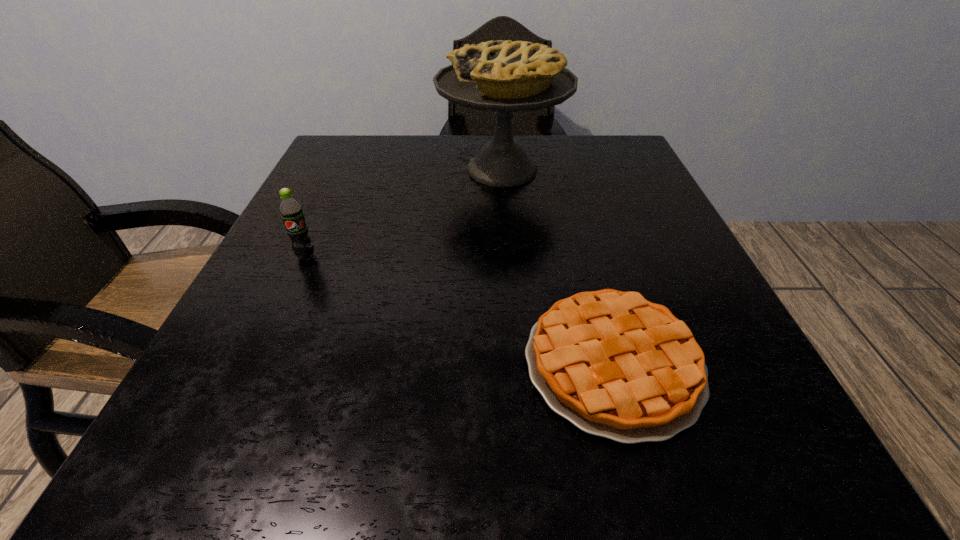
This screenshot has width=960, height=540. Find the location of `free space located 0.210m on the back of the shorter pie`. free space located 0.210m on the back of the shorter pie is located at coordinates (574, 224).

Identify the location of object that is at the far edge. (503, 76).

You are a GUI agent. You are given a task and a screenshot of the screen. Output one action in this format:
    pyautogui.click(x=<x>, y=<y>)
    Task: Click on the object present at the near edge
    
    Given the screenshot: What is the action you would take?
    pyautogui.click(x=615, y=365)

Locate an element on the screen. object that is at the left edge is located at coordinates (291, 211).

Identify the location of object that is positioned at the right edge. The image size is (960, 540). (615, 365).

Identify the location of object located at the near right corner. The height and width of the screenshot is (540, 960). (615, 365).

In the image, there is a desktop. At what (x,y) coordinates should I click in order to perform the action: click on vacant space at the far edge. Please return your answer as a coordinate pair (x, y). Looking at the image, I should click on (468, 159).

In the image, there is a desktop. Identify the location of free space at the left edge. This screenshot has width=960, height=540. (328, 212).

Locate an element on the screen. vacant space at the right edge of the desktop is located at coordinates (653, 199).

Where is `vacant space at the far right corner of the desktop`? This screenshot has width=960, height=540. vacant space at the far right corner of the desktop is located at coordinates (567, 139).